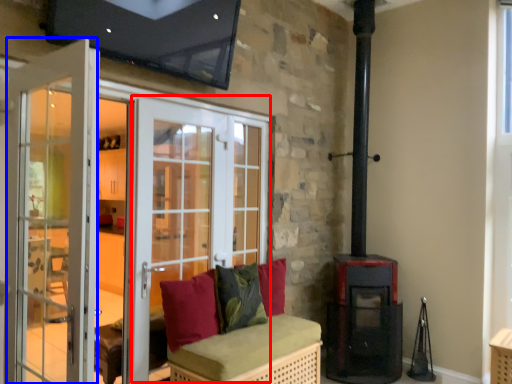
Question: Which of the following is the closest to the observer, screen door (highlighted by a red box) or screen door (highlighted by a blue box)?

Choices:
 (A) screen door
 (B) screen door

Answer: (B)